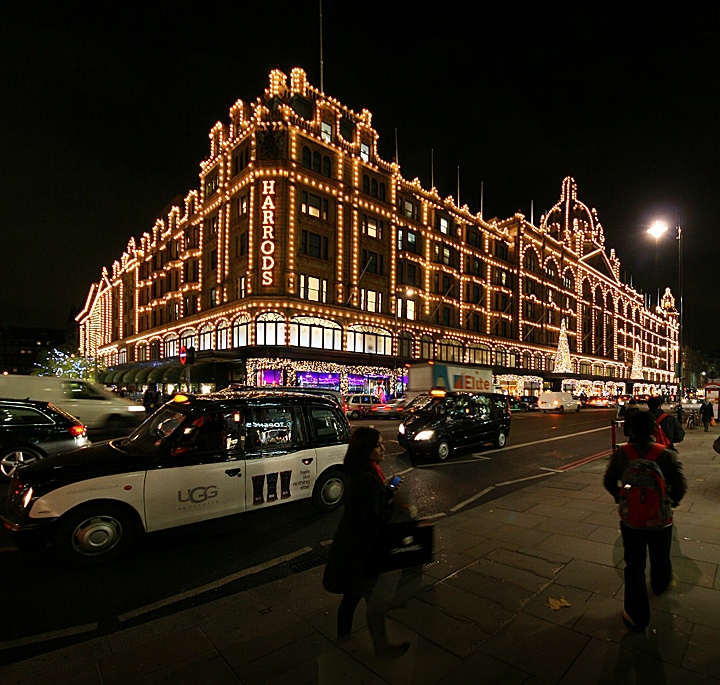
Where is `christmas lights`? christmas lights is located at coordinates (310, 366), (366, 366), (435, 329), (428, 210), (567, 192), (626, 299), (559, 344), (646, 369).